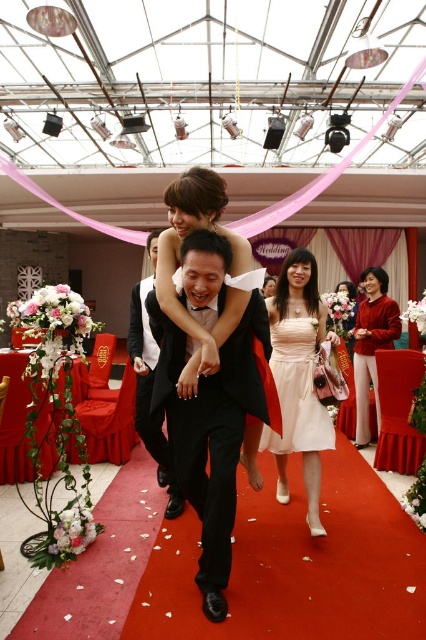
What do you see at coordinates (296, 388) in the screenshot? The height and width of the screenshot is (640, 426). I see `pale pink satin dress at center` at bounding box center [296, 388].

Which is behind, point (328, 422) or point (365, 348)?

Positioned behind is point (365, 348).

The height and width of the screenshot is (640, 426). What are the coordinates of `pale pink satin dress at center` in the screenshot? It's located at (296, 388).

Is black satin tuxedo at center below matte red sweater at center?

Yes.

From the picture: Measure the distance between black satin tuxedo at center and matte red sweater at center.

A distance of 2.35 meters exists between black satin tuxedo at center and matte red sweater at center.

Between point (210, 611) and point (371, 352), which one is positioned in front?

Point (210, 611)

Find the location of `black satin tuxedo at center`. black satin tuxedo at center is located at coordinates pyautogui.click(x=210, y=433).

Find the location of `black satin tuxedo at center`. black satin tuxedo at center is located at coordinates (210, 433).

Does black satin tuxedo at center have a lesser height compared to pale pink satin dress at center?

No.

Is point (215, 560) less distant than point (276, 336)?

Yes, point (215, 560) is closer to viewer.

In order to click on black satin tuxedo at center in this screenshot , I will do `click(210, 433)`.